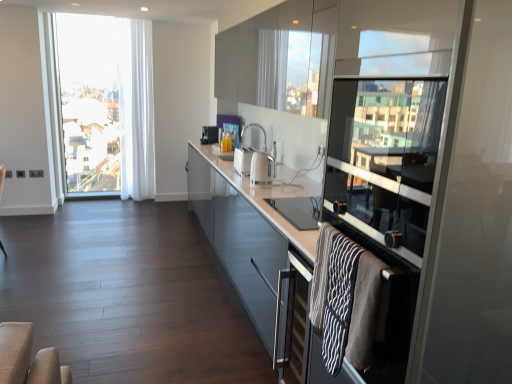
Question: Does glossy glass cabinets at upper center, which is the 2th cabinetry in bottom-to-top order, have a smaller size compared to glossy glass cabinet at center, the second cabinetry from the top?

Choices:
 (A) no
 (B) yes

Answer: (B)

Question: Can you confirm if glossy glass cabinets at upper center, the 1th cabinetry viewed from the top, is taller than glossy glass cabinet at center, the second cabinetry from the top?

Choices:
 (A) yes
 (B) no

Answer: (B)

Question: Is glossy glass cabinet at center, the second cabinetry from the top, inside glossy glass cabinets at upper center, the 1th cabinetry viewed from the top?

Choices:
 (A) no
 (B) yes

Answer: (A)

Question: Is glossy glass cabinets at upper center, which is the 2th cabinetry in bottom-to-top order, outside of glossy glass cabinet at center, the second cabinetry from the top?

Choices:
 (A) no
 (B) yes

Answer: (B)

Question: Is glossy glass cabinets at upper center, which is the 2th cabinetry in bottom-to-top order, to the right of glossy glass cabinet at center, positioned as the 1th cabinetry in bottom-to-top order, from the viewer's perspective?

Choices:
 (A) yes
 (B) no

Answer: (A)

Question: Is glossy glass cabinets at upper center, the 1th cabinetry viewed from the top, positioned in front of glossy glass cabinet at center, positioned as the 1th cabinetry in bottom-to-top order?

Choices:
 (A) yes
 (B) no

Answer: (B)

Question: From the image's perspective, does glossy glass cabinets at upper center, the 1th cabinetry viewed from the top, appear higher than clear glass window at left?

Choices:
 (A) no
 (B) yes

Answer: (B)

Question: Is glossy glass cabinets at upper center, the 1th cabinetry viewed from the top, taller than clear glass window at left?

Choices:
 (A) yes
 (B) no

Answer: (B)

Question: Can you confirm if glossy glass cabinets at upper center, the 1th cabinetry viewed from the top, is thinner than clear glass window at left?

Choices:
 (A) yes
 (B) no

Answer: (B)

Question: Does glossy glass cabinets at upper center, which is the 2th cabinetry in bottom-to-top order, have a greater width compared to clear glass window at left?

Choices:
 (A) no
 (B) yes

Answer: (B)

Question: From a real-world perspective, is glossy glass cabinets at upper center, the 1th cabinetry viewed from the top, positioned under clear glass window at left based on gravity?

Choices:
 (A) yes
 (B) no

Answer: (B)

Question: Does glossy glass cabinets at upper center, which is the 2th cabinetry in bottom-to-top order, turn towards clear glass window at left?

Choices:
 (A) yes
 (B) no

Answer: (B)

Question: From a real-world perspective, is satin silver toaster at center, which appears as the first appliance when viewed from the top, positioned over transparent glass screen door at right based on gravity?

Choices:
 (A) no
 (B) yes

Answer: (A)